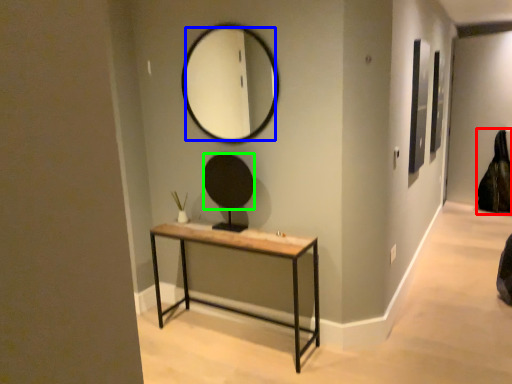
Question: Which object is positioned closest to swivel chair (highlighted by a red box)? Select from mirror (highlighted by a blue box) and mirror (highlighted by a green box).

Choices:
 (A) mirror
 (B) mirror

Answer: (A)